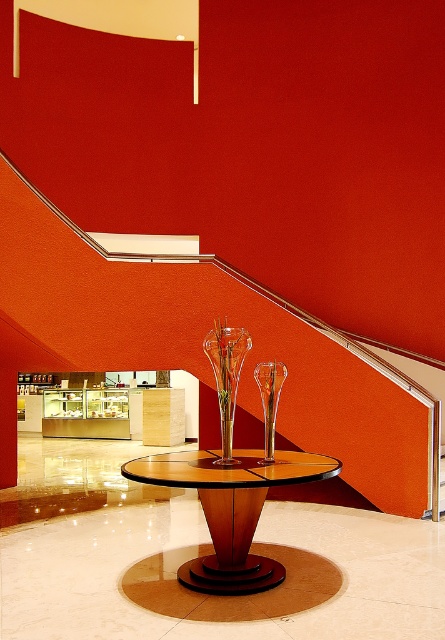
Question: Which point is closer to the camera taking this photo?

Choices:
 (A) (257, 371)
 (B) (136, 426)
 (C) (239, 490)
 (D) (246, 348)

Answer: (C)

Question: Where is transparent glass vase at center located in relation to clear glass vase at center in the image?

Choices:
 (A) above
 (B) below

Answer: (A)

Question: Which object is positioned farthest from the clear glass vase at center?

Choices:
 (A) wooden polished table at center
 (B) matte glass display case at center
 (C) transparent glass vase at center

Answer: (B)

Question: Estimate the real-world distances between objects in this image. Which object is farther from the clear glass vase at center?

Choices:
 (A) transparent glass vase at center
 (B) wooden polished table at center

Answer: (B)

Question: Is matte glass display case at center behind transparent glass vase at center?

Choices:
 (A) no
 (B) yes

Answer: (B)

Question: Is wooden polished table at center further to camera compared to matte glass display case at center?

Choices:
 (A) no
 (B) yes

Answer: (A)